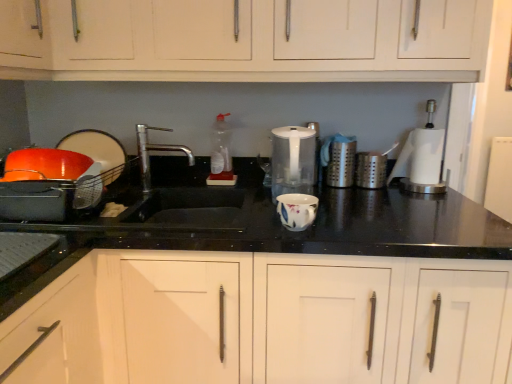
How much space does matte black bowl at left, which appears as the 2th appliance when viewed from the left, occupy horizontally?

2.36 inches.

The width and height of the screenshot is (512, 384). Describe the element at coordinates (246, 41) in the screenshot. I see `white matte cabinet at upper center, which is the first cabinetry from top to bottom` at that location.

Describe the element at coordinates (370, 170) in the screenshot. I see `satin silver canister at center right, which appears as the 5th appliance when viewed from the left` at that location.

Looking at this image, what is the approximate height of satin silver canister at center right, the first appliance viewed from the right?

It is 5.59 inches.

Where is `white plastic blender at right`? white plastic blender at right is located at coordinates (422, 158).

The image size is (512, 384). What do you see at coordinates (292, 160) in the screenshot? I see `transparent plastic kettle at center, acting as the third appliance starting from the right` at bounding box center [292, 160].

In order to face transparent plastic kettle at center, acting as the third appliance starting from the right, should I rotate leftwards or rightwards?

You should look right and rotate roughly 5.211 degrees.

Identify the location of matte black bowl at left, which appears as the 2th appliance when viewed from the left. Image resolution: width=512 pixels, height=384 pixels. (98, 151).

Considering the positions of points (218, 124) and (139, 135), is point (218, 124) farther from camera compared to point (139, 135)?

No, (218, 124) is in front of (139, 135).

Considering the sizes of objects clear plastic bottle at center and silver metallic faucet at center in the image provided, who is wider, clear plastic bottle at center or silver metallic faucet at center?

silver metallic faucet at center.

From a real-world perspective, is clear plastic bottle at center positioned over silver metallic faucet at center based on gravity?

Yes, from a real-world perspective, clear plastic bottle at center is over silver metallic faucet at center

Considering the relative positions of white wood cabinet at center, the first cabinetry when ordered from bottom to top, and matte black bowl at left, which is counted as the fourth appliance, starting from the right, in the image provided, is white wood cabinet at center, the first cabinetry when ordered from bottom to top, to the right of matte black bowl at left, which is counted as the fourth appliance, starting from the right, from the viewer's perspective?

Yes, white wood cabinet at center, the first cabinetry when ordered from bottom to top, is to the right of matte black bowl at left, which is counted as the fourth appliance, starting from the right.

Based on the photo, could matte black bowl at left, which appears as the 2th appliance when viewed from the left, be considered to be inside white wood cabinet at center, the first cabinetry when ordered from bottom to top?

Definitely not — matte black bowl at left, which appears as the 2th appliance when viewed from the left, is not inside white wood cabinet at center, the first cabinetry when ordered from bottom to top.

From the picture: Which of these two, white wood cabinet at center, which is counted as the second cabinetry, starting from the top, or matte black bowl at left, which appears as the 2th appliance when viewed from the left, is smaller?

matte black bowl at left, which appears as the 2th appliance when viewed from the left, is smaller.

In order to click on blender on the right of transparent plastic kettle at center, acting as the third appliance starting from the left in this screenshot , I will do (422, 158).

Which is behind, point (407, 190) or point (305, 164)?

The point (407, 190) is more distant.

In the image, is white plastic blender at right on the left side or the right side of transparent plastic kettle at center, acting as the third appliance starting from the right?

In the image, white plastic blender at right appears on the right side of transparent plastic kettle at center, acting as the third appliance starting from the right.

Which is behind, white plastic blender at right or transparent plastic kettle at center, acting as the third appliance starting from the right?

white plastic blender at right is further away from the camera.

Is white wood cabinet at center, which is counted as the second cabinetry, starting from the top, wider than clear plastic bottle at center?

Yes, white wood cabinet at center, which is counted as the second cabinetry, starting from the top, is wider than clear plastic bottle at center.

Find the location of a particular element. The image size is (512, 384). bottle behind the white wood cabinet at center, which is counted as the second cabinetry, starting from the top is located at coordinates (221, 155).

Can you confirm if white wood cabinet at center, the first cabinetry when ordered from bottom to top, is positioned to the right of clear plastic bottle at center?

Indeed, white wood cabinet at center, the first cabinetry when ordered from bottom to top, is positioned on the right side of clear plastic bottle at center.

In terms of height, does white wood cabinet at center, the first cabinetry when ordered from bottom to top, look taller or shorter compared to clear plastic bottle at center?

In the image, white wood cabinet at center, the first cabinetry when ordered from bottom to top, appears to be taller than clear plastic bottle at center.

From a real-world perspective, is porcelain floral mug at center physically above white matte cabinet at upper center, which is the first cabinetry from top to bottom?

No, from a real-world perspective, porcelain floral mug at center is not over white matte cabinet at upper center, which is the first cabinetry from top to bottom

Is the depth of porcelain floral mug at center greater than that of white matte cabinet at upper center, which is the first cabinetry from top to bottom?

Yes, porcelain floral mug at center is further from the viewer.

Can you confirm if porcelain floral mug at center is taller than white matte cabinet at upper center, arranged as the second cabinetry when ordered from the bottom?

In fact, porcelain floral mug at center may be shorter than white matte cabinet at upper center, arranged as the second cabinetry when ordered from the bottom.

From the image's perspective, which one is positioned lower, porcelain floral mug at center or white matte cabinet at upper center, which is the first cabinetry from top to bottom?

From the image's view, porcelain floral mug at center is below.

Is white matte cabinet at upper center, arranged as the second cabinetry when ordered from the bottom, surrounding satin silver canister at center, the 2th appliance in the right-to-left sequence?

Actually, satin silver canister at center, the 2th appliance in the right-to-left sequence, is outside white matte cabinet at upper center, arranged as the second cabinetry when ordered from the bottom.

Considering the sizes of objects white matte cabinet at upper center, arranged as the second cabinetry when ordered from the bottom, and satin silver canister at center, the 2th appliance in the right-to-left sequence, in the image provided, who is shorter, white matte cabinet at upper center, arranged as the second cabinetry when ordered from the bottom, or satin silver canister at center, the 2th appliance in the right-to-left sequence,?

Result: With less height is satin silver canister at center, the 2th appliance in the right-to-left sequence.

In terms of size, does white matte cabinet at upper center, arranged as the second cabinetry when ordered from the bottom, appear bigger or smaller than satin silver canister at center, the 2th appliance in the right-to-left sequence?

white matte cabinet at upper center, arranged as the second cabinetry when ordered from the bottom, is bigger than satin silver canister at center, the 2th appliance in the right-to-left sequence.

Would you consider white matte cabinet at upper center, which is the first cabinetry from top to bottom, to be distant from satin silver canister at center, the 4th appliance when ordered from left to right?

No, there isn't a large distance between white matte cabinet at upper center, which is the first cabinetry from top to bottom, and satin silver canister at center, the 4th appliance when ordered from left to right.

Does silver metallic faucet at center lie in front of white wood cabinet at center, the first cabinetry when ordered from bottom to top?

No, the depth of silver metallic faucet at center is greater than that of white wood cabinet at center, the first cabinetry when ordered from bottom to top.

Which is in front, point (170, 148) or point (145, 330)?

The point (145, 330) is closer to the camera.

Do you think silver metallic faucet at center is within white wood cabinet at center, the first cabinetry when ordered from bottom to top, or outside of it?

silver metallic faucet at center is outside white wood cabinet at center, the first cabinetry when ordered from bottom to top.

Where is `tap below the clear plastic bottle at center (from a real-world perspective)`? This screenshot has width=512, height=384. tap below the clear plastic bottle at center (from a real-world perspective) is located at coordinates (154, 150).

Identify the location of cabinetry that is below the matte black bowl at left, which is counted as the fourth appliance, starting from the right (from the image's perspective). This screenshot has height=384, width=512. (264, 320).

Estimate the real-world distances between objects in this image. Which object is further from matte black bowl at left, which is counted as the fourth appliance, starting from the right, white matte cabinet at upper center, which is the first cabinetry from top to bottom, or white plastic blender at right?

white plastic blender at right.

When comparing their distances from clear plastic bottle at center, does white wood cabinet at center, which is counted as the second cabinetry, starting from the top, or orange matte bowl at left, acting as the 1th appliance starting from the left, seem further?

white wood cabinet at center, which is counted as the second cabinetry, starting from the top, is positioned further to the anchor clear plastic bottle at center.

When comparing their distances from satin silver canister at center, the 2th appliance in the right-to-left sequence, does satin silver canister at center right, the first appliance viewed from the right, or white matte cabinet at upper center, arranged as the second cabinetry when ordered from the bottom, seem further?

Based on the image, white matte cabinet at upper center, arranged as the second cabinetry when ordered from the bottom, appears to be further to satin silver canister at center, the 2th appliance in the right-to-left sequence.

When comparing their distances from satin silver canister at center right, which appears as the 5th appliance when viewed from the left, does white wood cabinet at center, the first cabinetry when ordered from bottom to top, or transparent plastic kettle at center, acting as the third appliance starting from the left, seem closer?

transparent plastic kettle at center, acting as the third appliance starting from the left, is positioned closer to the anchor satin silver canister at center right, which appears as the 5th appliance when viewed from the left.

Estimate the real-world distances between objects in this image. Which object is closer to white plastic blender at right, satin silver canister at center right, the first appliance viewed from the right, or porcelain floral mug at center?

satin silver canister at center right, the first appliance viewed from the right, lies closer to white plastic blender at right than the other object.

Which object lies further to the anchor point silver metallic faucet at center, matte black bowl at left, which appears as the 2th appliance when viewed from the left, or satin silver canister at center right, the first appliance viewed from the right?

Among the two, satin silver canister at center right, the first appliance viewed from the right, is located further to silver metallic faucet at center.

Based on their spatial positions, is porcelain floral mug at center or clear plastic bottle at center closer to satin silver canister at center, the 2th appliance in the right-to-left sequence?

clear plastic bottle at center lies closer to satin silver canister at center, the 2th appliance in the right-to-left sequence, than the other object.

From the picture: From the image, which object appears to be nearer to clear plastic bottle at center, orange matte bowl at left, acting as the 1th appliance starting from the left, or white wood cabinet at center, which is counted as the second cabinetry, starting from the top?

The object closer to clear plastic bottle at center is orange matte bowl at left, acting as the 1th appliance starting from the left.

Locate an element on the screen. Image resolution: width=512 pixels, height=384 pixels. tap located between matte black bowl at left, which is counted as the fourth appliance, starting from the right, and satin silver canister at center, the 4th appliance when ordered from left to right, in the left-right direction is located at coordinates (154, 150).

The image size is (512, 384). Find the location of `mug situated between matte black bowl at left, which appears as the 2th appliance when viewed from the left, and transparent plastic kettle at center, acting as the third appliance starting from the left, from left to right`. mug situated between matte black bowl at left, which appears as the 2th appliance when viewed from the left, and transparent plastic kettle at center, acting as the third appliance starting from the left, from left to right is located at coordinates click(x=297, y=210).

Identify the location of mug between white wood cabinet at center, the first cabinetry when ordered from bottom to top, and clear plastic bottle at center from front to back. This screenshot has height=384, width=512. (297, 210).

Where is `appliance positioned between white matte cabinet at upper center, which is the first cabinetry from top to bottom, and transparent plastic kettle at center, acting as the third appliance starting from the right, from near to far`? This screenshot has height=384, width=512. appliance positioned between white matte cabinet at upper center, which is the first cabinetry from top to bottom, and transparent plastic kettle at center, acting as the third appliance starting from the right, from near to far is located at coordinates click(x=45, y=184).